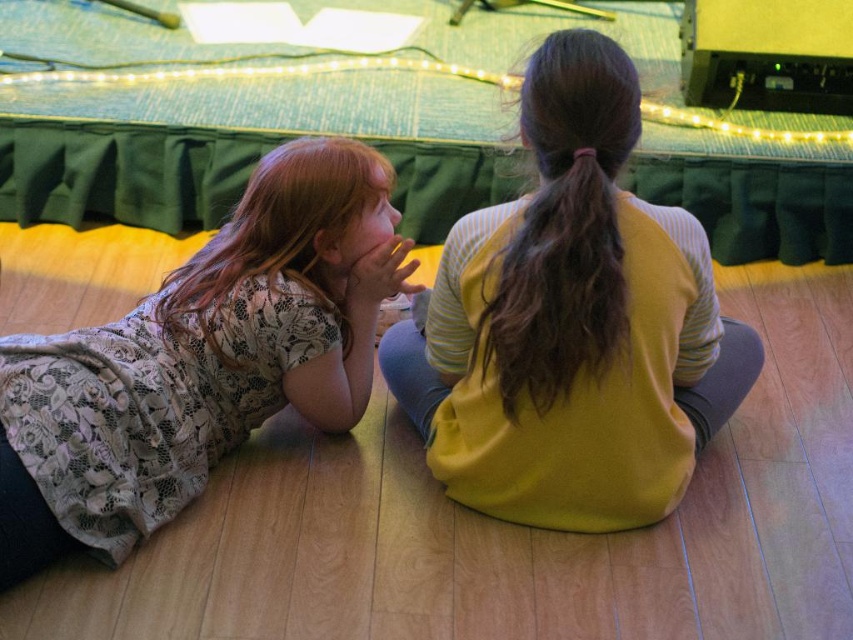
Question: Can you confirm if yellow matte sweater at center is smaller than brown silky hair at center?

Choices:
 (A) yes
 (B) no

Answer: (B)

Question: Estimate the real-world distances between objects in this image. Which object is farther from the brown silky hair at center?

Choices:
 (A) yellow matte sweater at center
 (B) lace fabric dress at lower left

Answer: (B)

Question: Is yellow matte sweater at center positioned before lace fabric dress at lower left?

Choices:
 (A) no
 (B) yes

Answer: (B)

Question: Among these points, which one is farthest from the camera?

Choices:
 (A) (473, 449)
 (B) (395, 280)

Answer: (B)

Question: Which of these objects is positioned closest to the yellow matte sweater at center?

Choices:
 (A) brown silky hair at center
 (B) lace fabric dress at lower left

Answer: (A)

Question: Does lace fabric dress at lower left come behind brown silky hair at center?

Choices:
 (A) yes
 (B) no

Answer: (A)